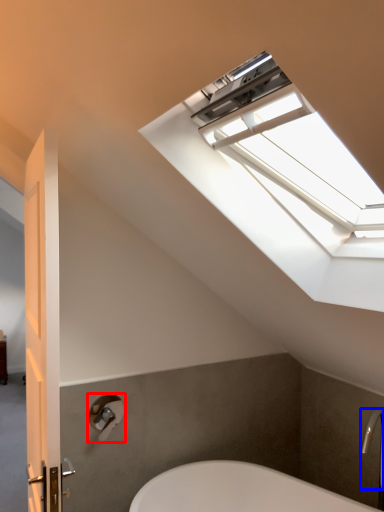
Question: Which object is further to the camera taking this photo, shower (highlighted by a red box) or faucet (highlighted by a blue box)?

Choices:
 (A) shower
 (B) faucet

Answer: (A)